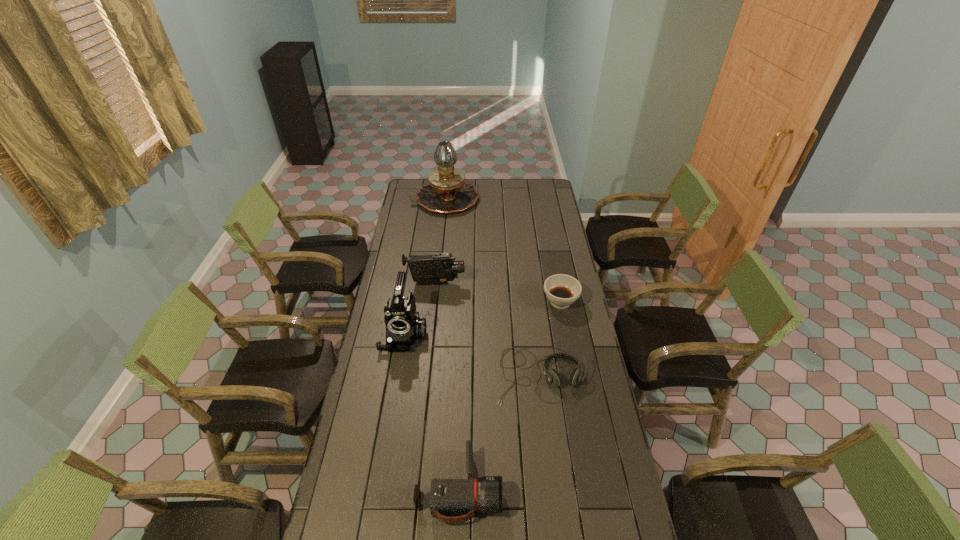
Image resolution: width=960 pixels, height=540 pixels. Identify the location of free space located 0.210m on the right of the farthest object. (514, 200).

Where is `free space located on the lens mount of the second nearest camcorder`? The width and height of the screenshot is (960, 540). free space located on the lens mount of the second nearest camcorder is located at coordinates (396, 377).

Where is `vacant space located 0.360m on the front-facing side of the farthest camcorder`? The width and height of the screenshot is (960, 540). vacant space located 0.360m on the front-facing side of the farthest camcorder is located at coordinates (540, 284).

The width and height of the screenshot is (960, 540). I want to click on vacant position located on the lens of the shortest camcorder, so click(567, 488).

You are a GUI agent. You are given a task and a screenshot of the screen. Output one action in this format:
    pyautogui.click(x=<x>, y=<y>)
    Task: Click on the vacant space located 0.400m on the back of the soup bowl
    This screenshot has height=540, width=960.
    Given the screenshot: What is the action you would take?
    (548, 239)

You are a GUI agent. You are given a task and a screenshot of the screen. Output one action in this format:
    pyautogui.click(x=<x>, y=<y>)
    Task: Click on the vacant area situated 0.370m on the outer surface of the headset
    The height and width of the screenshot is (540, 960).
    Given the screenshot: What is the action you would take?
    pyautogui.click(x=557, y=514)

The image size is (960, 540). I want to click on object positioned at the far edge, so click(x=447, y=192).

I want to click on oil lamp located in the left edge section of the desktop, so click(x=447, y=192).

This screenshot has width=960, height=540. What are the coordinates of `soup bowl situated at the right edge` in the screenshot? It's located at (562, 290).

You are a GUI agent. You are given a task and a screenshot of the screen. Output one action in this format:
    pyautogui.click(x=<x>, y=<y>)
    Task: Click on the headset located at the right edge
    This screenshot has height=540, width=960.
    Given the screenshot: What is the action you would take?
    pyautogui.click(x=552, y=375)